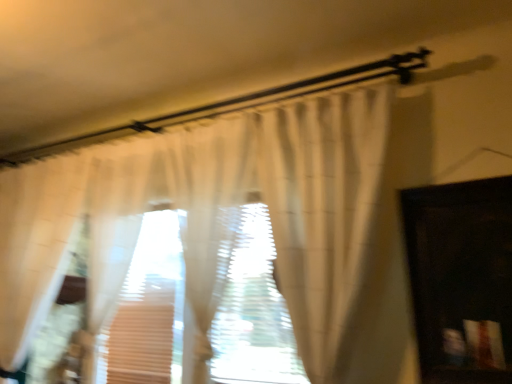
This screenshot has width=512, height=384. Describe the element at coordinates (253, 312) in the screenshot. I see `translucent fabric at center` at that location.

Where is `translucent fabric at center`? translucent fabric at center is located at coordinates (253, 312).

Locate an element on the screen. The width and height of the screenshot is (512, 384). translucent fabric at center is located at coordinates (253, 312).